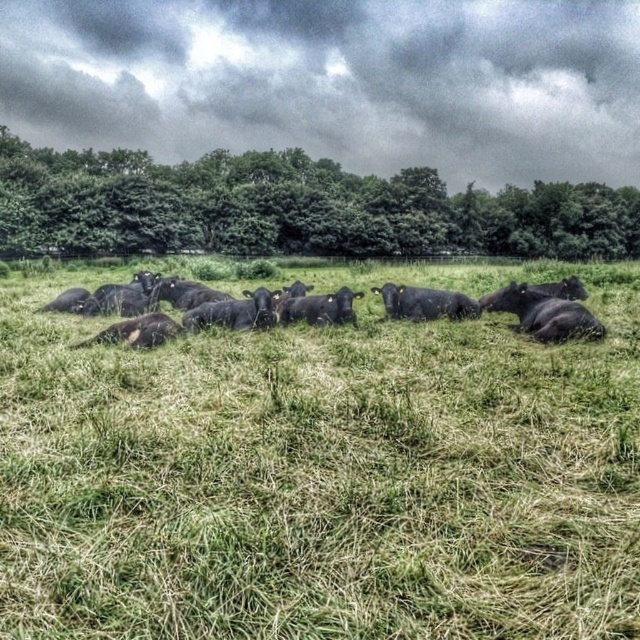
Between point (461, 173) and point (433, 189), which one is positioned behind?

Point (461, 173)

Can you confirm if dark gray cloud at upper center is thinner than green leafy tree at upper center?

Incorrect, dark gray cloud at upper center's width is not less than green leafy tree at upper center's.

Locate an element on the screen. This screenshot has height=640, width=640. dark gray cloud at upper center is located at coordinates (337, 81).

Find the location of a particular element. Image resolution: width=640 pixels, height=640 pixels. dark gray cloud at upper center is located at coordinates coord(337,81).

Image resolution: width=640 pixels, height=640 pixels. Describe the element at coordinates (321, 474) in the screenshot. I see `black grass at center` at that location.

Identify the location of black grass at center. Image resolution: width=640 pixels, height=640 pixels. (321, 474).

Who is positioned more to the left, black matte cows at center or black matte cow at center?

From the viewer's perspective, black matte cows at center appears more on the left side.

Is point (150, 323) less distant than point (412, 305)?

Yes, point (150, 323) is in front of point (412, 305).

Which is behind, point (433, 316) or point (460, 292)?

The point (460, 292) is more distant.

You are a GUI agent. You are given a task and a screenshot of the screen. Output one action in this format:
    pyautogui.click(x=<x>, y=<y>)
    Task: Click on the black matte cows at center
    The width and height of the screenshot is (640, 640).
    Given the screenshot: What is the action you would take?
    pyautogui.click(x=497, y=307)